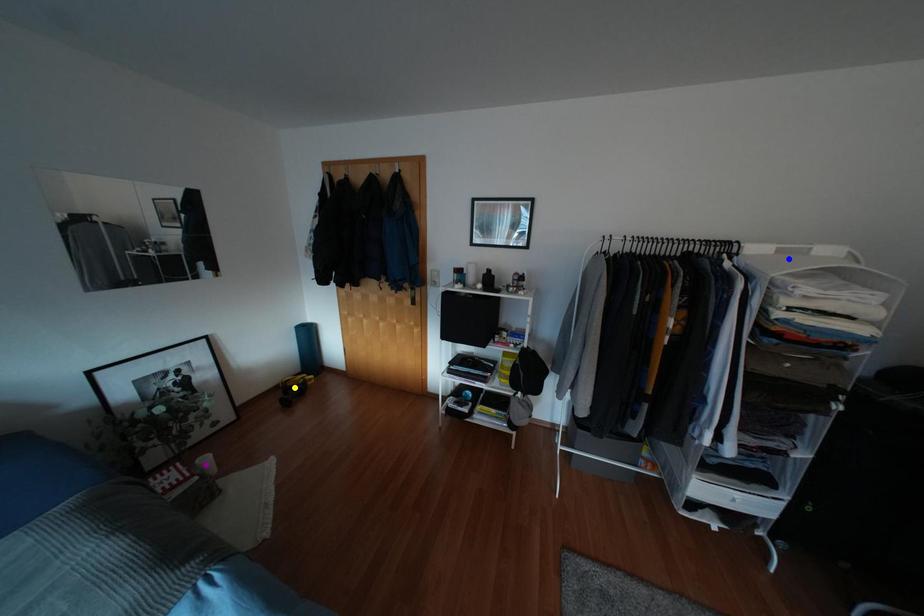
Order these from nearest to farthest:
purple point | yellow point | blue point

blue point < purple point < yellow point